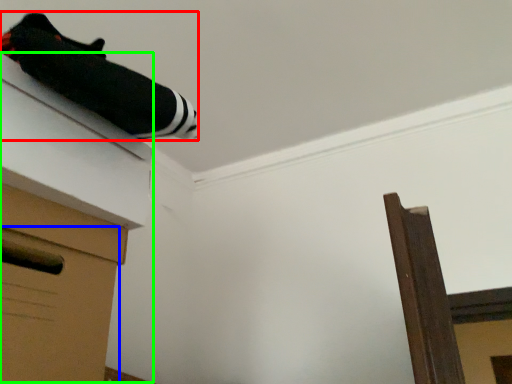
Question: Which object is the closest to the twin (highlighted by a red box)? Choose among these: drawer (highlighted by a blue box) or vanity (highlighted by a green box).

Choices:
 (A) drawer
 (B) vanity

Answer: (B)